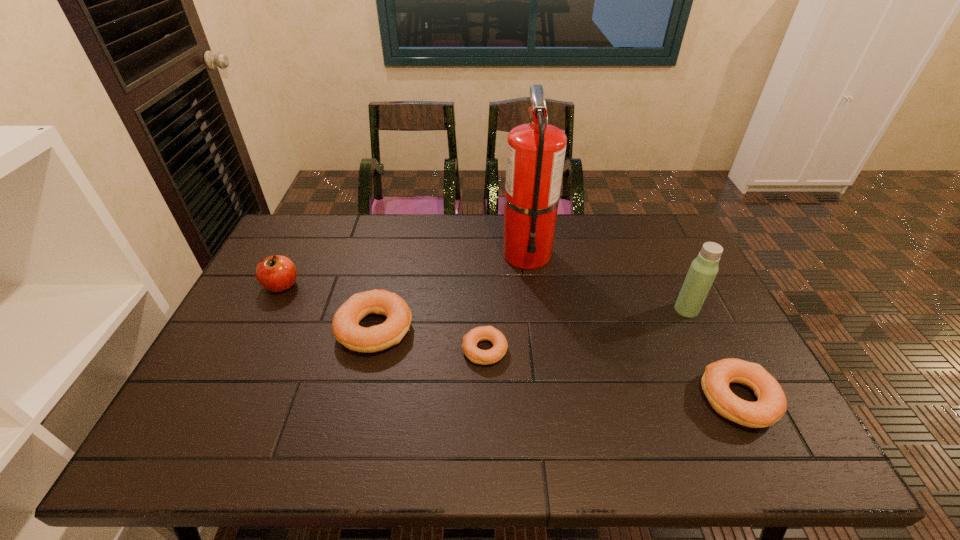
The height and width of the screenshot is (540, 960). Find the location of `bagel that is the closest to the shortest bagel`. bagel that is the closest to the shortest bagel is located at coordinates (345, 326).

You are a GUI agent. You are given a task and a screenshot of the screen. Output one action in this format:
    pyautogui.click(x=<x>, y=<y>)
    Task: Click on the bagel object that ranks as the third closest to the thermos bottle
    This screenshot has height=540, width=960.
    Given the screenshot: What is the action you would take?
    pyautogui.click(x=345, y=326)

Identify the location of free space in the image that satisfies the following two spatial constraints: 1. on the front side of the second shortest bagel; 2. on the right side of the fourth shortest object. (226, 400).